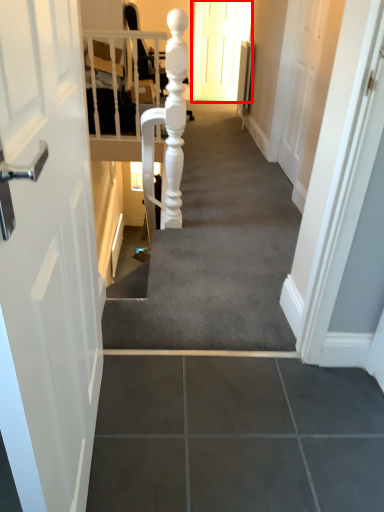
Question: Observing the image, what is the correct spatial positioning of door (annotated by the red box) in reference to stairwell?

Choices:
 (A) left
 (B) right

Answer: (B)